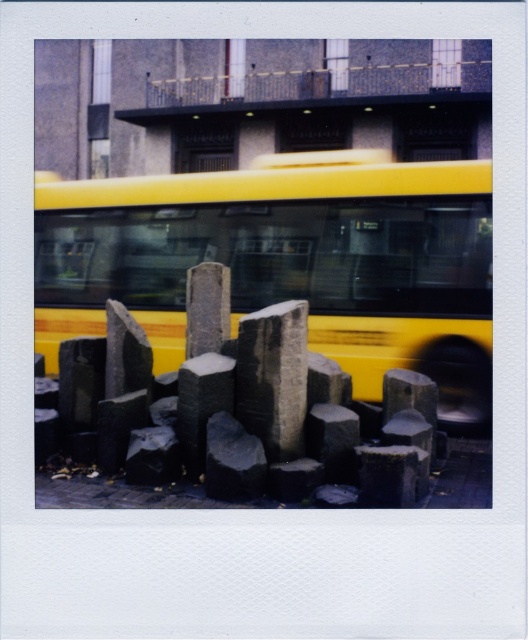
How far apart are yellow matte bus at center and dark gray stone at center?

yellow matte bus at center and dark gray stone at center are 5.16 meters apart.

Can you confirm if yellow matte bus at center is positioned to the left of dark gray stone at center?

Indeed, yellow matte bus at center is positioned on the left side of dark gray stone at center.

Find the location of `yellow matte bus at center`. yellow matte bus at center is located at coordinates (287, 260).

What do you see at coordinates (287, 260) in the screenshot? The image size is (528, 640). I see `yellow matte bus at center` at bounding box center [287, 260].

Can you confirm if yellow matte bus at center is thinner than dark gray stone boulder at center?

Yes, yellow matte bus at center is thinner than dark gray stone boulder at center.

You are a GUI agent. You are given a task and a screenshot of the screen. Output one action in this format:
    pyautogui.click(x=<x>, y=<y>)
    Task: Click on the yellow matte bus at center
    Image resolution: width=528 pixels, height=640 pixels.
    Given the screenshot: What is the action you would take?
    pyautogui.click(x=287, y=260)

Which is more to the right, dark gray stone at center or dark gray stone boulder at center?

Positioned to the right is dark gray stone boulder at center.

Can you confirm if dark gray stone at center is shorter than dark gray stone boulder at center?

No, dark gray stone at center is not shorter than dark gray stone boulder at center.

Who is more distant from viewer, (281, 452) or (251, 394)?

The point (251, 394) is behind.

This screenshot has width=528, height=640. What are the coordinates of `dark gray stone at center` in the screenshot? It's located at (244, 419).